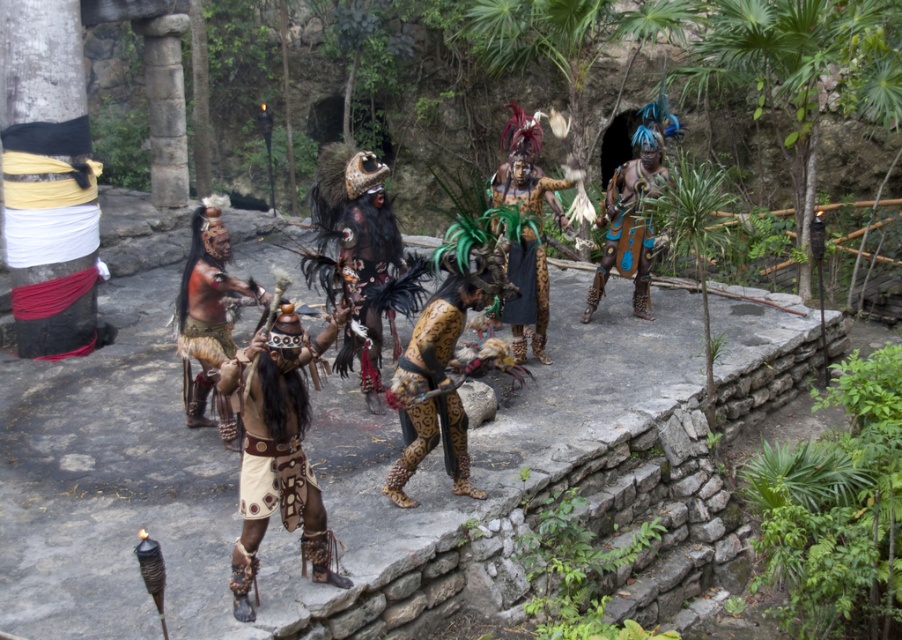
You are a photographer at the event and need to capture a closeup shot of both the blue painted skin at center and the leopard print skirt at center. Since your camera can only focus on one subject at a time, which one should you choose to ensure the details are clear?

The blue painted skin at center has a larger size compared to the leopard print skirt at center, so choosing it will ensure the details are clearer in the closeup shot.

In the scene shown: In the scene, there are two central items of clothing or accessories. The first is the matte brown leather armor at center, and the second is the green feathered headdress at center. From the perspective of someone standing in front of these items, which one is positioned to the left?

The matte brown leather armor at center is to the left of the green feathered headdress at center.